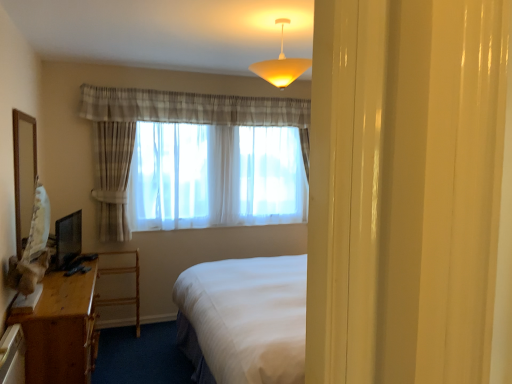
Describe the element at coordinates (68, 239) in the screenshot. I see `matte black monitor at left` at that location.

The height and width of the screenshot is (384, 512). What are the coordinates of `wooden desk at left` in the screenshot? It's located at (123, 273).

Is sheer white curtain at center positioned with its back to matte yellow plastic lampshade at upper center?

sheer white curtain at center is not turned away from matte yellow plastic lampshade at upper center.

The height and width of the screenshot is (384, 512). I want to click on curtain beneath the matte yellow plastic lampshade at upper center (from a real-world perspective), so click(196, 159).

Considering the sizes of sheer white curtain at center and matte yellow plastic lampshade at upper center in the image, is sheer white curtain at center bigger or smaller than matte yellow plastic lampshade at upper center?

In the image, sheer white curtain at center appears to be larger than matte yellow plastic lampshade at upper center.

From the image's perspective, between wooden desk at lower left and wooden mirror at left, which one is located above?

wooden mirror at left is shown above in the image.

Is wooden desk at lower left looking in the opposite direction of wooden mirror at left?

That's not correct — wooden desk at lower left is not looking away from wooden mirror at left.

Is wooden desk at lower left to the left or to the right of wooden mirror at left in the image?

Based on their positions, wooden desk at lower left is located to the right of wooden mirror at left.

Between wooden desk at lower left and wooden mirror at left, which one has larger width?

With larger width is wooden desk at lower left.

Is wooden mirror at left oriented away from wooden desk at left?

No, wooden mirror at left's orientation is not away from wooden desk at left.

From the image's perspective, is wooden mirror at left located above wooden desk at left?

Yes, from the image's perspective, wooden mirror at left is above wooden desk at left.

In terms of size, does wooden mirror at left appear bigger or smaller than wooden desk at left?

wooden mirror at left is smaller than wooden desk at left.

Are wooden mirror at left and wooden desk at left located far from each other?

wooden mirror at left is far away from wooden desk at left.

Can we say matte black monitor at left lies outside matte yellow plastic lampshade at upper center?

Yes, matte black monitor at left is not within matte yellow plastic lampshade at upper center.

What's the angular difference between matte black monitor at left and matte yellow plastic lampshade at upper center's facing directions?

There is a 78.5-degree angle between the facing directions of matte black monitor at left and matte yellow plastic lampshade at upper center.

Can you confirm if matte black monitor at left is positioned to the left of matte yellow plastic lampshade at upper center?

Yes, matte black monitor at left is to the left of matte yellow plastic lampshade at upper center.

Which object is wider, sheer white curtain at center or wooden mirror at left?

sheer white curtain at center.

Looking at this image, how many degrees apart are the facing directions of sheer white curtain at center and wooden mirror at left?

There is a 89.8-degree angle between the facing directions of sheer white curtain at center and wooden mirror at left.

Is sheer white curtain at center looking in the opposite direction of wooden mirror at left?

No.

Is sheer white curtain at center outside of wooden mirror at left?

That's correct, sheer white curtain at center is outside of wooden mirror at left.

In terms of height, does wooden desk at left look taller or shorter compared to wooden desk at lower left?

Considering their sizes, wooden desk at left has less height than wooden desk at lower left.

From the image's perspective, who appears lower, wooden desk at left or wooden desk at lower left?

wooden desk at lower left is shown below in the image.

How different are the orientations of wooden desk at left and wooden desk at lower left in degrees?

The facing directions of wooden desk at left and wooden desk at lower left are 90 degrees apart.

Is point (125, 251) closer or farther from the camera than point (42, 315)?

Point (125, 251).

Can you see wooden mirror at left touching wooden desk at lower left?

wooden mirror at left and wooden desk at lower left are clearly separated.

Which is more to the left, wooden mirror at left or wooden desk at lower left?

wooden mirror at left is more to the left.

Does point (32, 192) come behind point (11, 324)?

Yes, it is.

In the scene shown: Considering the sizes of wooden mirror at left and wooden desk at lower left in the image, is wooden mirror at left bigger or smaller than wooden desk at lower left?

Clearly, wooden mirror at left is smaller in size than wooden desk at lower left.

Locate an element on the screen. lamp in front of the sheer white curtain at center is located at coordinates (281, 65).

Find the location of `mirror lying on the left of wooden desk at lower left`. mirror lying on the left of wooden desk at lower left is located at coordinates (24, 174).

Looking at the image, which one is located further to matte black monitor at left, wooden desk at left or wooden mirror at left?

Among the two, wooden mirror at left is located further to matte black monitor at left.

Considering their positions, is matte yellow plastic lampshade at upper center positioned further to matte black monitor at left than wooden desk at left?

matte yellow plastic lampshade at upper center lies further to matte black monitor at left than the other object.

When comparing their distances from sheer white curtain at center, does matte yellow plastic lampshade at upper center or wooden desk at lower left seem closer?

Among the two, wooden desk at lower left is located nearer to sheer white curtain at center.

Considering their positions, is wooden mirror at left positioned further to wooden desk at left than matte black monitor at left?

wooden mirror at left lies further to wooden desk at left than the other object.

When comparing their distances from sheer white curtain at center, does matte black monitor at left or matte yellow plastic lampshade at upper center seem further?

Based on the image, matte yellow plastic lampshade at upper center appears to be further to sheer white curtain at center.

Consider the image. Estimate the real-world distances between objects in this image. Which object is closer to matte black monitor at left, sheer white curtain at center or wooden desk at left?

wooden desk at left.

From the image, which object appears to be farther from wooden desk at left, wooden mirror at left or matte yellow plastic lampshade at upper center?

Based on the image, matte yellow plastic lampshade at upper center appears to be further to wooden desk at left.

From the image, which object appears to be nearer to wooden mirror at left, wooden desk at left or matte yellow plastic lampshade at upper center?

wooden desk at left lies closer to wooden mirror at left than the other object.

At what (x,y) coordinates should I click in order to perform the action: click on furniture between wooden mirror at left and matte yellow plastic lampshade at upper center in the horizontal direction. Please return your answer as a coordinate pair (x, y). This screenshot has height=384, width=512. Looking at the image, I should click on (x=123, y=273).

Image resolution: width=512 pixels, height=384 pixels. Find the location of `television between wooden mirror at left and wooden desk at left in the up-down direction`. television between wooden mirror at left and wooden desk at left in the up-down direction is located at coordinates (68, 239).

Where is `curtain between wooden desk at lower left and wooden desk at left from front to back`? curtain between wooden desk at lower left and wooden desk at left from front to back is located at coordinates (196, 159).

Locate an element on the screen. The height and width of the screenshot is (384, 512). mirror between wooden desk at lower left and sheer white curtain at center from front to back is located at coordinates (24, 174).